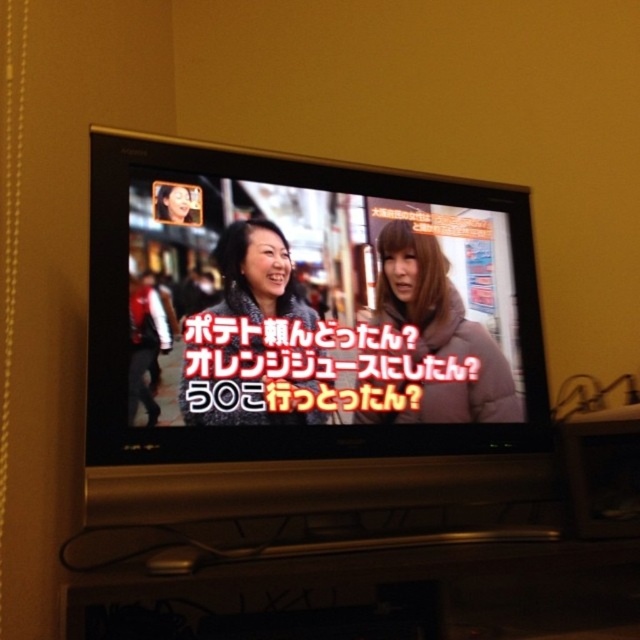
Question: From the image, what is the correct spatial relationship of matte black television at center in relation to puffy brown jacket at center?

Choices:
 (A) right
 (B) left

Answer: (B)

Question: Which of the following is the farthest from the observer?

Choices:
 (A) puffy brown jacket at center
 (B) matte black television at center

Answer: (A)

Question: Is matte black television at center closer to the viewer compared to matte gray jacket at center?

Choices:
 (A) yes
 (B) no

Answer: (A)

Question: Which point is farther to the camera?

Choices:
 (A) puffy brown jacket at center
 (B) matte black television at center

Answer: (A)

Question: Observing the image, what is the correct spatial positioning of matte black television at center in reference to matte gray jacket at center?

Choices:
 (A) right
 (B) left

Answer: (A)

Question: Among these points, which one is farthest from the camera?

Choices:
 (A) (241, 291)
 (B) (422, 308)

Answer: (B)